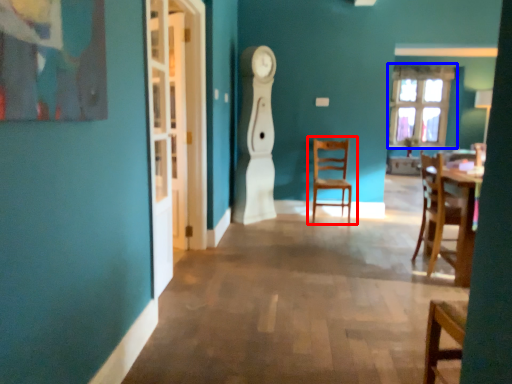
Question: Which object appears farthest to the camera in this image, chair (highlighted by a red box) or window (highlighted by a blue box)?

Choices:
 (A) chair
 (B) window

Answer: (B)